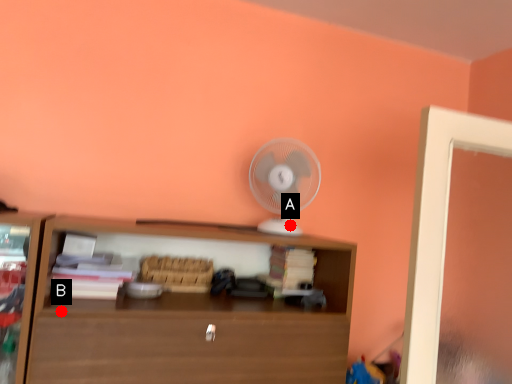
Question: Two points are circled on the image, labeled by A and B beside each circle. Which point is further to the camera?

Choices:
 (A) A is further
 (B) B is further

Answer: (A)